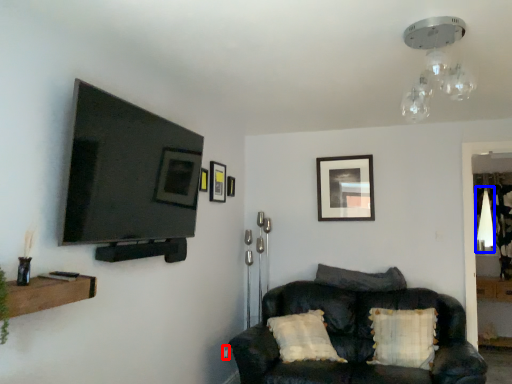
Question: Among these objects, which one is nearest to the camera, electric outlet (highlighted by a red box) or light fixture (highlighted by a blue box)?

Choices:
 (A) electric outlet
 (B) light fixture

Answer: (A)